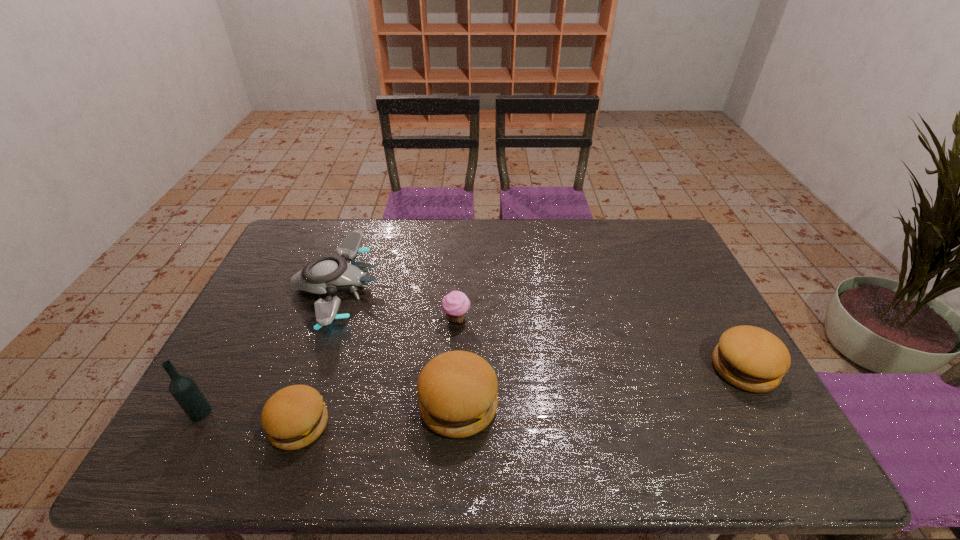
Locate an element on the screen. The image size is (960, 540). the leftmost hamburger is located at coordinates (295, 416).

At what (x,y) coordinates should I click in order to perform the action: click on the second hamburger from right to left. Please return your answer as a coordinate pair (x, y). The width and height of the screenshot is (960, 540). Looking at the image, I should click on (457, 390).

Identify the location of the rightmost hamburger. (750, 358).

Locate an element on the screen. This screenshot has height=540, width=960. the fourth shortest object is located at coordinates (750, 358).

The width and height of the screenshot is (960, 540). Identify the location of cupcake. (455, 304).

Image resolution: width=960 pixels, height=540 pixels. What are the coordinates of `drone` in the screenshot? It's located at (326, 274).

In order to click on vodka in this screenshot , I will do `click(183, 388)`.

The image size is (960, 540). Identify the location of the leftmost object. (183, 388).

Locate an element on the screen. free space located 0.270m on the right of the shortest hamburger is located at coordinates [444, 425].

Where is `vacant space located on the back of the second hamburger from right to left`? Image resolution: width=960 pixels, height=540 pixels. vacant space located on the back of the second hamburger from right to left is located at coordinates (464, 276).